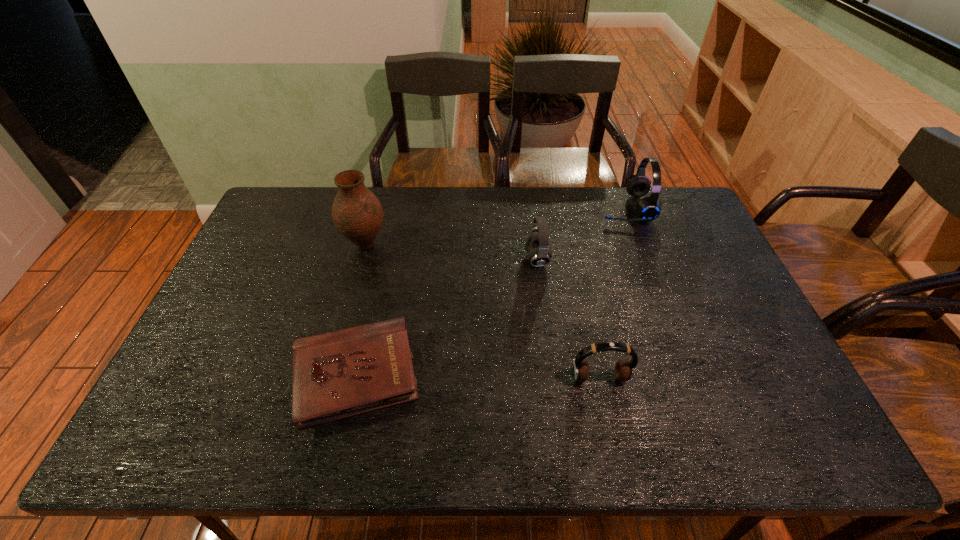
Locate an element on the screen. The image size is (960, 540). vacant space located 0.140m on the ear cushions of the farthest headset is located at coordinates (559, 208).

Where is `free space located 0.370m on the ear cushions of the farthest headset`? The image size is (960, 540). free space located 0.370m on the ear cushions of the farthest headset is located at coordinates (494, 208).

The width and height of the screenshot is (960, 540). I want to click on vacant space positioned on the ear cups of the leftmost headset, so click(505, 259).

What are the coordinates of `vacant region located on the ear cups of the leftmost headset` in the screenshot? It's located at (464, 259).

Find the location of a particular element. vacant space located on the ear cups of the leftmost headset is located at coordinates (480, 259).

The height and width of the screenshot is (540, 960). I want to click on vacant space located on the ear cup of the second headset from right to left, so click(x=607, y=414).

Locate an element on the screen. vacant space located 0.230m on the left of the hardback book is located at coordinates (198, 376).

Where is `object at the far edge`? object at the far edge is located at coordinates point(648,208).

I want to click on object situated at the near edge, so click(338, 374).

This screenshot has height=540, width=960. I want to click on object that is at the right edge, so click(648, 208).